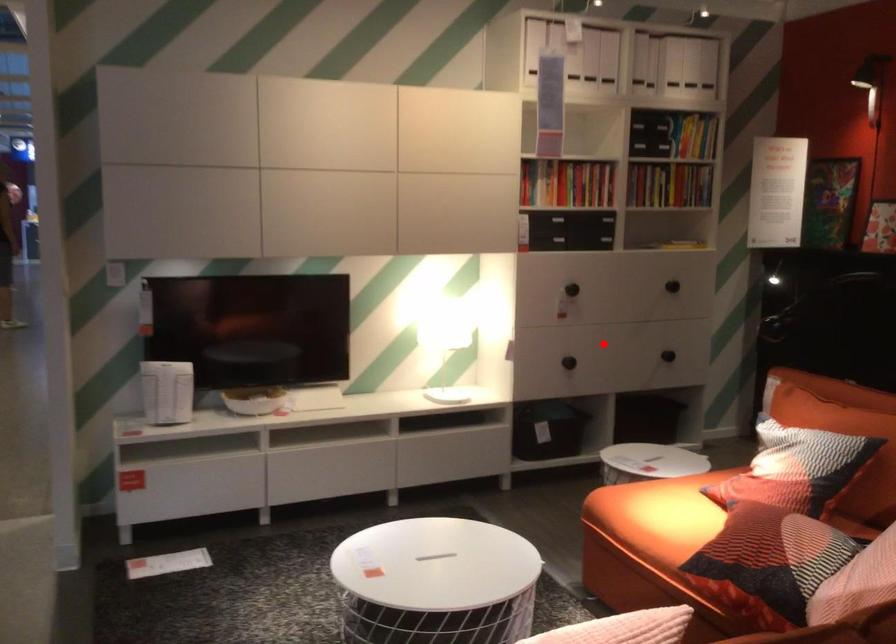
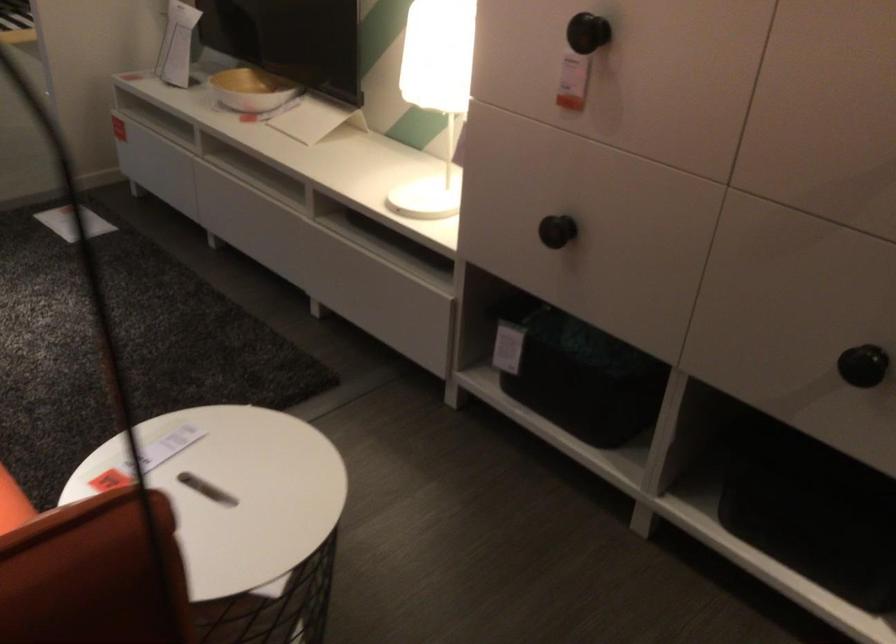
Question: I am providing you with two images of the same scene from different viewpoints. Given a red point in image1, look at the same physical point in image2. Is it:

Choices:
 (A) Closer to the viewpoint
 (B) Farther from the viewpoint

Answer: (A)